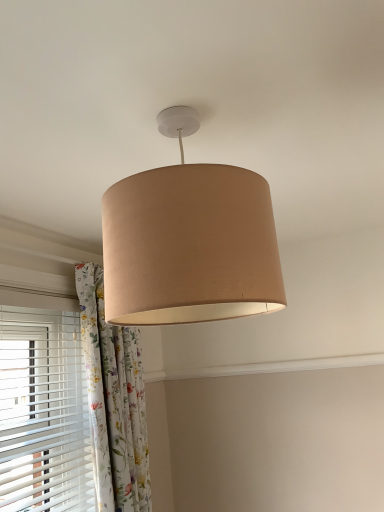
At what (x,y) coordinates should I click in order to perform the action: click on floral fabric curtain at center. Please return your answer as a coordinate pair (x, y). The image size is (384, 512). Looking at the image, I should click on (114, 401).

What do you see at coordinates (114, 401) in the screenshot? I see `floral fabric curtain at center` at bounding box center [114, 401].

What is the approximate height of floral fabric curtain at center?

3.44 feet.

What do you see at coordinates (189, 241) in the screenshot?
I see `beige fabric lampshade at center` at bounding box center [189, 241].

Measure the distance between beige fabric lampshade at center and camera.

The distance of beige fabric lampshade at center from camera is 24.85 inches.

The image size is (384, 512). I want to click on beige fabric lampshade at center, so click(x=189, y=241).

I want to click on floral fabric curtain at center, so click(114, 401).

Considering the relative positions of floral fabric curtain at center and beige fabric lampshade at center in the image provided, is floral fabric curtain at center to the right of beige fabric lampshade at center from the viewer's perspective?

In fact, floral fabric curtain at center is to the left of beige fabric lampshade at center.

Considering their positions, is floral fabric curtain at center located in front of or behind beige fabric lampshade at center?

Visually, floral fabric curtain at center is located behind beige fabric lampshade at center.

Between point (105, 405) and point (156, 208), which one is positioned behind?

Positioned behind is point (105, 405).

From the image's perspective, relative to beige fabric lampshade at center, is floral fabric curtain at center above or below?

Based on their image positions, floral fabric curtain at center is located beneath beige fabric lampshade at center.

From a real-world perspective, is floral fabric curtain at center over beige fabric lampshade at center?

No, from a real-world perspective, floral fabric curtain at center is not on top of beige fabric lampshade at center.

Between floral fabric curtain at center and beige fabric lampshade at center, which one has smaller width?

Thinner between the two is floral fabric curtain at center.

Who is shorter, floral fabric curtain at center or beige fabric lampshade at center?

With less height is beige fabric lampshade at center.

Considering the sizes of objects floral fabric curtain at center and beige fabric lampshade at center in the image provided, who is smaller, floral fabric curtain at center or beige fabric lampshade at center?

Smaller between the two is beige fabric lampshade at center.

Is beige fabric lampshade at center located within floral fabric curtain at center?

No, floral fabric curtain at center does not contain beige fabric lampshade at center.

Is floral fabric curtain at center next to beige fabric lampshade at center and touching it?

No, floral fabric curtain at center is not beside beige fabric lampshade at center.

Is floral fabric curtain at center looking in the opposite direction of beige fabric lampshade at center?

No, floral fabric curtain at center's orientation is not away from beige fabric lampshade at center.

Can you tell me how much floral fabric curtain at center and beige fabric lampshade at center differ in facing direction?

The angular difference between floral fabric curtain at center and beige fabric lampshade at center is 1.33 degrees.

How distant is floral fabric curtain at center from beige fabric lampshade at center?

floral fabric curtain at center is 94.50 centimeters away from beige fabric lampshade at center.

Identify the location of lamp that is in front of the floral fabric curtain at center. (189, 241).

Which is more to the left, beige fabric lampshade at center or floral fabric curtain at center?

From the viewer's perspective, floral fabric curtain at center appears more on the left side.

Which object is further away from the camera taking this photo, beige fabric lampshade at center or floral fabric curtain at center?

floral fabric curtain at center.

Does point (210, 209) appear closer or farther from the camera than point (121, 348)?

Point (210, 209) is positioned closer to the camera compared to point (121, 348).

From the image's perspective, which one is positioned higher, beige fabric lampshade at center or floral fabric curtain at center?

beige fabric lampshade at center.

From the picture: From a real-world perspective, between beige fabric lampshade at center and floral fabric curtain at center, who is vertically higher?

beige fabric lampshade at center is physically above.

Considering the sizes of objects beige fabric lampshade at center and floral fabric curtain at center in the image provided, who is thinner, beige fabric lampshade at center or floral fabric curtain at center?

With smaller width is floral fabric curtain at center.

Considering the relative sizes of beige fabric lampshade at center and floral fabric curtain at center in the image provided, is beige fabric lampshade at center taller than floral fabric curtain at center?

No.

Is beige fabric lampshade at center bigger or smaller than floral fabric curtain at center?

beige fabric lampshade at center is smaller than floral fabric curtain at center.

Is beige fabric lampshade at center situated inside floral fabric curtain at center or outside?

beige fabric lampshade at center exists outside the volume of floral fabric curtain at center.

Are beige fabric lampshade at center and floral fabric curtain at center beside each other?

No, beige fabric lampshade at center is not in contact with floral fabric curtain at center.

Is beige fabric lampshade at center facing towards floral fabric curtain at center?

No, beige fabric lampshade at center does not turn towards floral fabric curtain at center.

Can you tell me how much beige fabric lampshade at center and floral fabric curtain at center differ in facing direction?

beige fabric lampshade at center and floral fabric curtain at center are facing 1.33 degrees away from each other.

Where is `curtain located behind the beige fabric lampshade at center`? Image resolution: width=384 pixels, height=512 pixels. curtain located behind the beige fabric lampshade at center is located at coordinates (114, 401).

I want to click on lamp above the floral fabric curtain at center (from the image's perspective), so click(x=189, y=241).

The width and height of the screenshot is (384, 512). I want to click on lamp located above the floral fabric curtain at center (from a real-world perspective), so click(x=189, y=241).